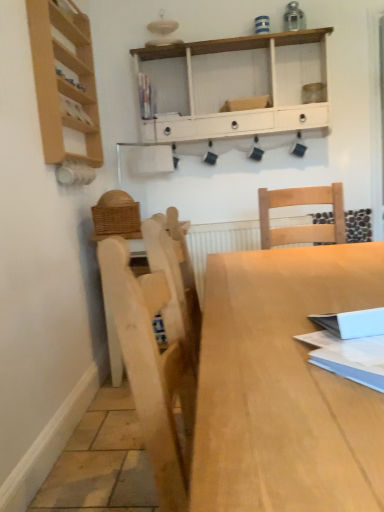
The image size is (384, 512). Identify the location of blank space to the left of white paper book at right, the 2th book positioned from the top. (286, 389).